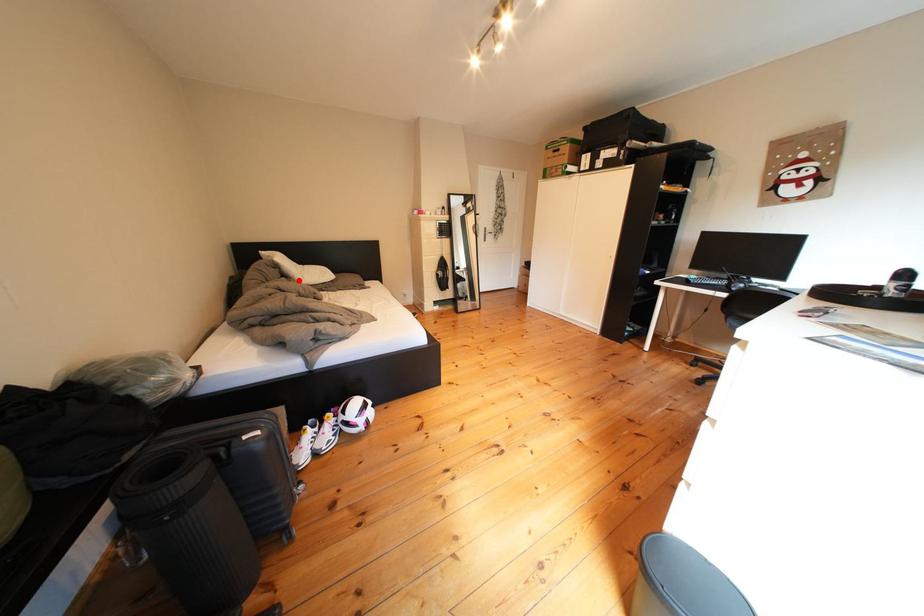
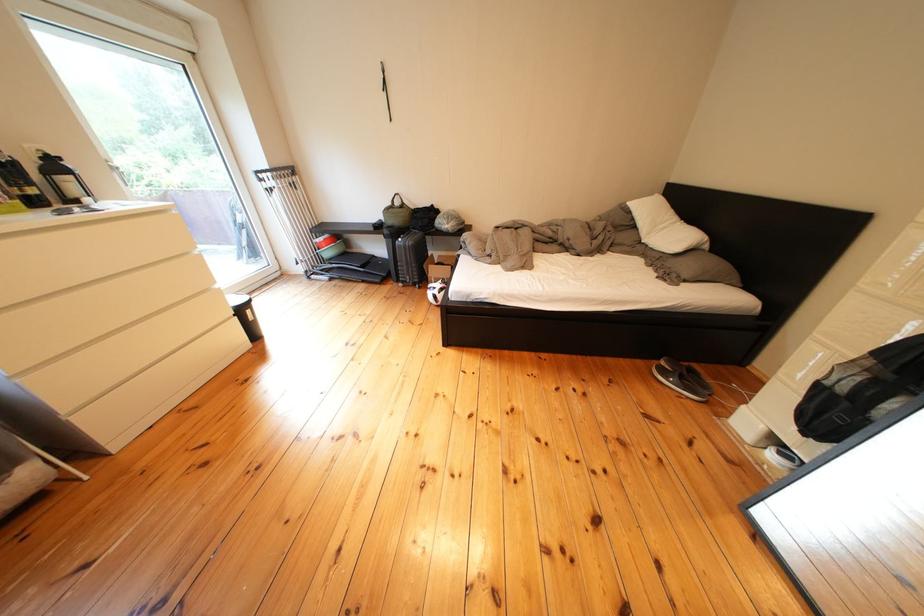
Find the pixel in the second image that matches the highlighted location in the first image.

(649, 230)